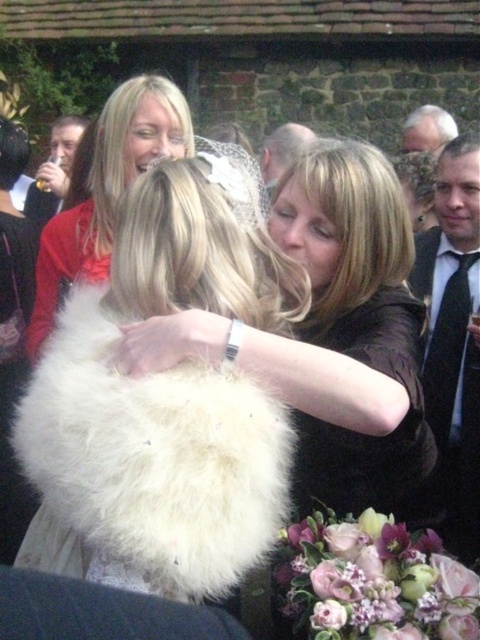
Question: Estimate the real-world distances between objects in this image. Which object is farther from the matte black jacket at upper left?

Choices:
 (A) white fluffy coat at center
 (B) black tie at right
 (C) matte white fur at center

Answer: (B)

Question: Is matte black jacket at upper left thinner than white hair at upper right?

Choices:
 (A) yes
 (B) no

Answer: (B)

Question: Is white fluffy fur at center to the left of black tie at right from the viewer's perspective?

Choices:
 (A) yes
 (B) no

Answer: (A)

Question: Is black tie at right wider than smooth bald head at center?

Choices:
 (A) no
 (B) yes

Answer: (B)

Question: Which of the following is the closest to the observer?

Choices:
 (A) (71, 548)
 (B) (72, 216)

Answer: (A)

Question: Which of these objects is positioned closest to the matte black jacket at upper left?

Choices:
 (A) smooth bald head at center
 (B) matte white fur at center
 (C) white fluffy fur at center
 (D) white hair at upper right

Answer: (B)